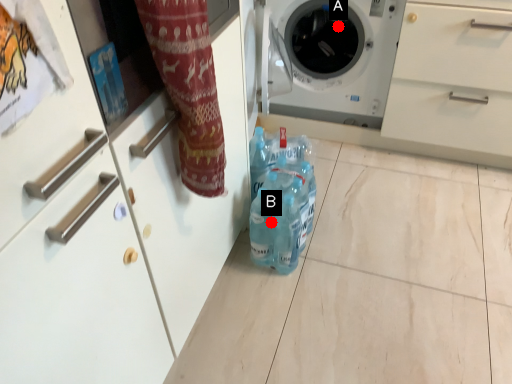
Question: Two points are circled on the image, labeled by A and B beside each circle. Which of the following is the farthest from the observer?

Choices:
 (A) A is further
 (B) B is further

Answer: (A)